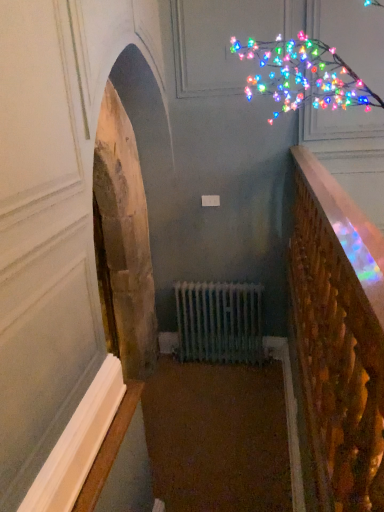
This screenshot has height=512, width=384. What do you see at coordinates (339, 336) in the screenshot?
I see `wooden baluster at right` at bounding box center [339, 336].

Identify the location of wooden baluster at right. (339, 336).

Image resolution: width=384 pixels, height=512 pixels. I want to click on wooden baluster at right, so click(339, 336).